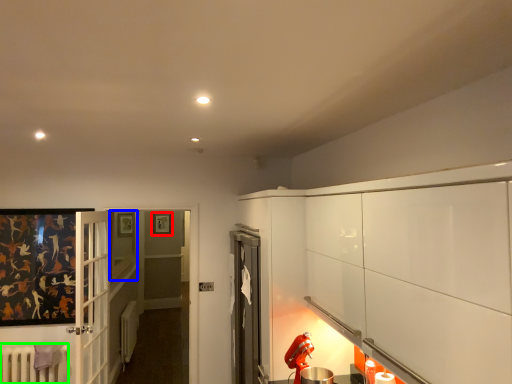
Question: Which object is positioned closest to picture frame (highlighted by a red box)? Select from window (highlighted by a blue box) and radiator (highlighted by a green box).

Choices:
 (A) window
 (B) radiator

Answer: (A)